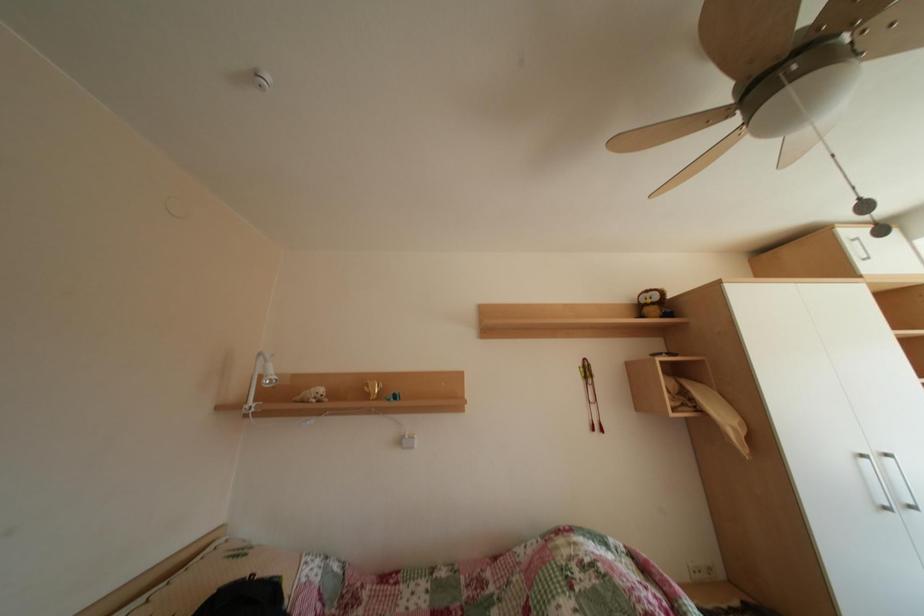
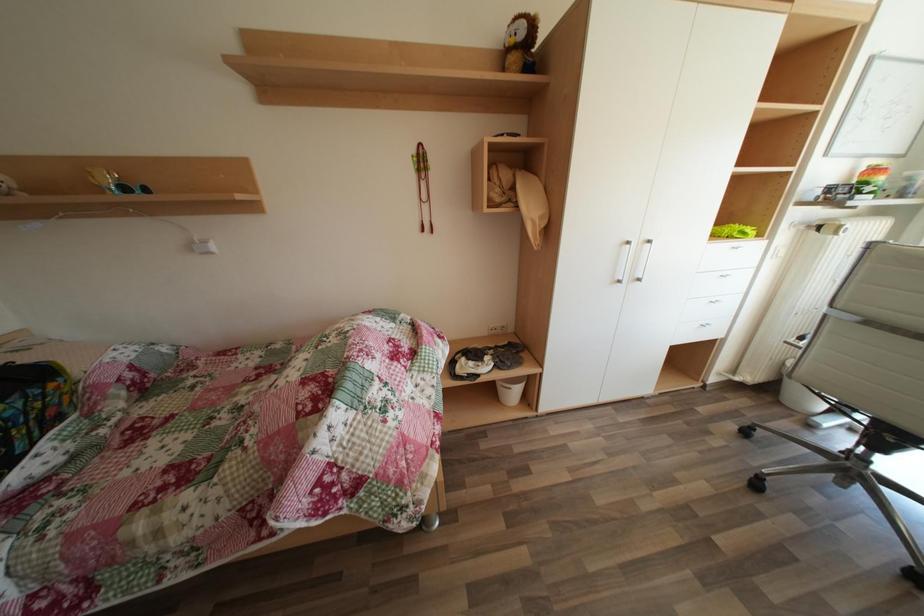
Question: How did the camera likely rotate?

Choices:
 (A) Left
 (B) Right
 (C) Up
 (D) Down

Answer: (D)